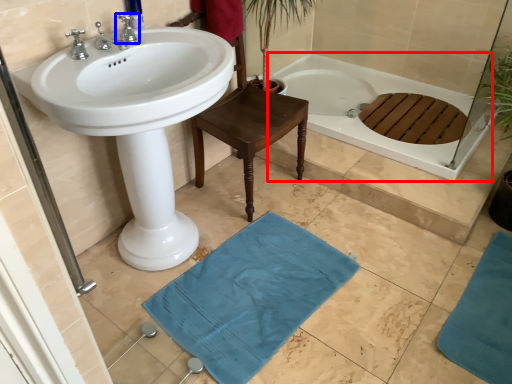
Question: Which point is further to the camera, bathtub (highlighted by a red box) or tap (highlighted by a blue box)?

Choices:
 (A) bathtub
 (B) tap

Answer: (A)